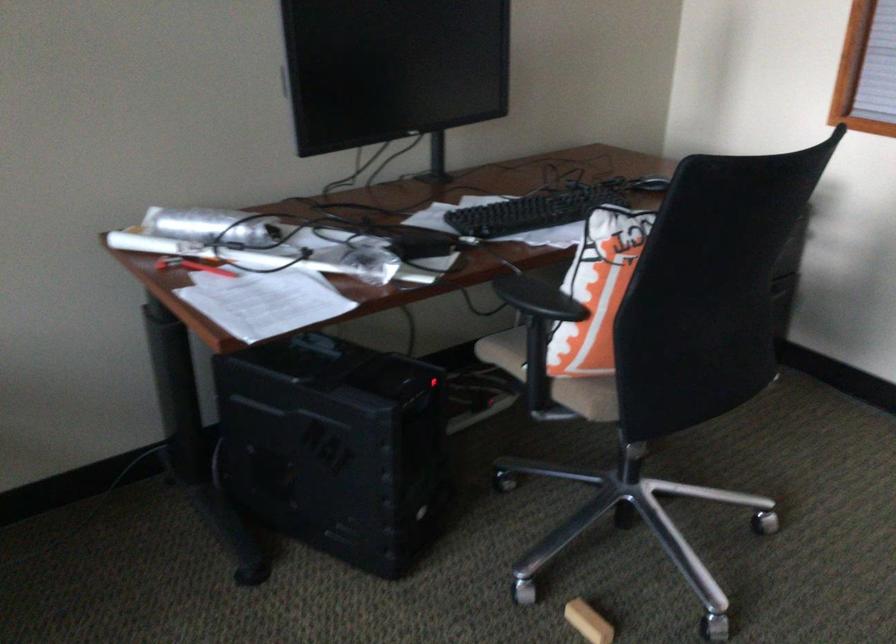
Where is `beige chair sitting surface`? Image resolution: width=896 pixels, height=644 pixels. beige chair sitting surface is located at coordinates (552, 377).